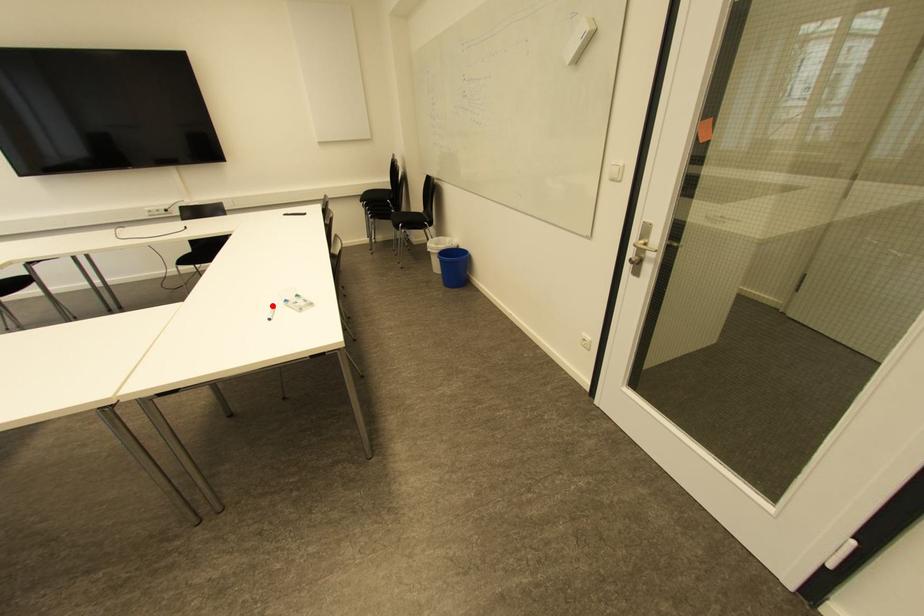
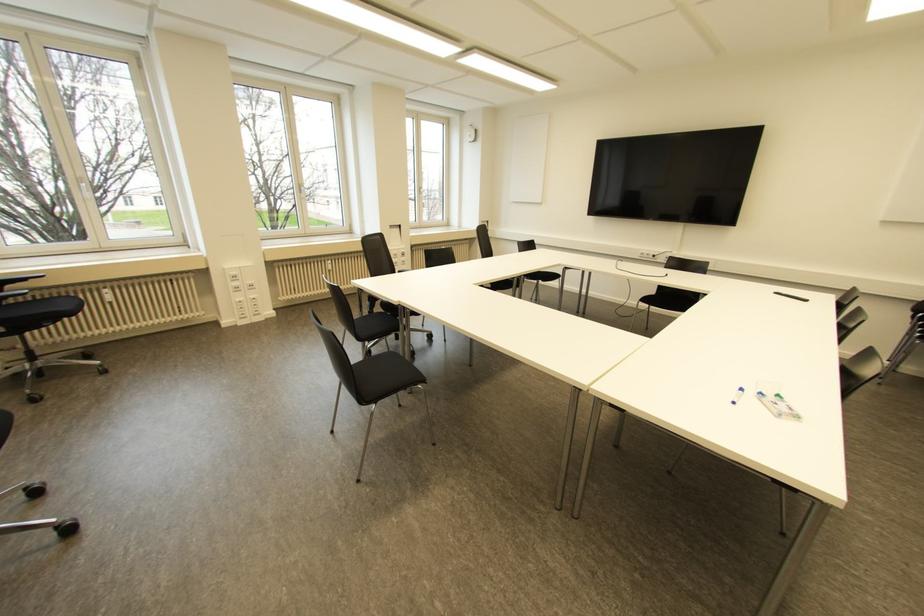
The point at the highlighted location is marked in the first image. Where is the corresponding point in the second image?

(739, 390)